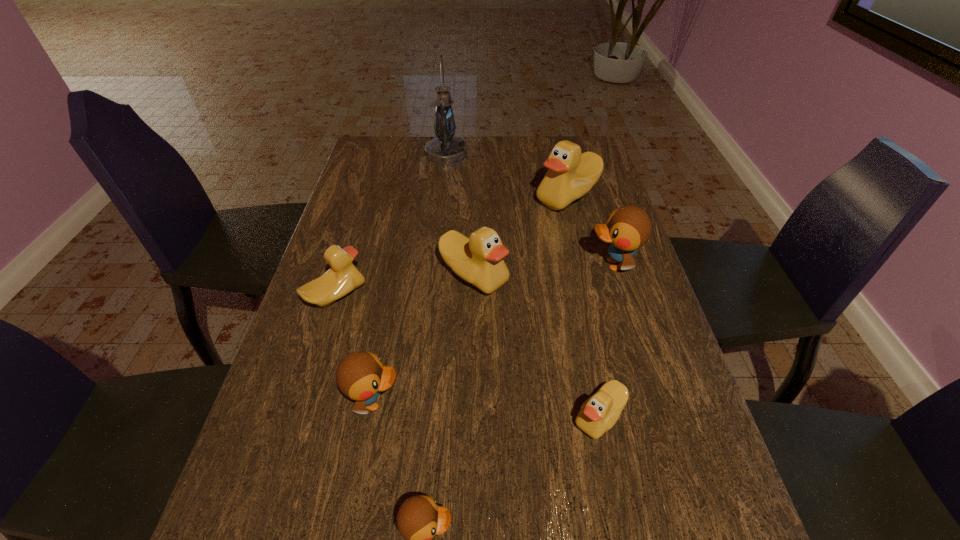
You are a GUI agent. You are given a task and a screenshot of the screen. Output one action in this format:
    pyautogui.click(x=<x>, y=<y>)
    Task: Click on the vacant area between the leftmost beige duck and the second nearest blue duck
    The height and width of the screenshot is (540, 960).
    Given the screenshot: What is the action you would take?
    click(355, 348)

Image resolution: width=960 pixels, height=540 pixels. What are the coordinates of `vacant area between the tallest object and the farthest blue duck` in the screenshot? It's located at (530, 209).

Identify the location of unoccupied position between the farthest blue duck and the biggest beige duck. This screenshot has height=540, width=960. (590, 231).

Where is `vacant region between the second smallest beige duck and the second duck from left to right`? The width and height of the screenshot is (960, 540). vacant region between the second smallest beige duck and the second duck from left to right is located at coordinates (355, 348).

Identify the location of blank region between the third beige duck from right to left and the nearest beige duck. Image resolution: width=960 pixels, height=540 pixels. (537, 346).

In order to click on free space between the farthest beige duck and the tallest object in this screenshot , I will do `click(507, 175)`.

What are the coordinates of `free space between the second nearest blue duck and the tallest object` in the screenshot? It's located at (411, 278).

Where is `object that is the third closest to the second blue duck from right to left`? The image size is (960, 540). object that is the third closest to the second blue duck from right to left is located at coordinates (343, 277).

You are a GUI agent. You are given a task and a screenshot of the screen. Output one action in this format:
    pyautogui.click(x=<x>, y=<y>)
    Task: Click on the object that ranks as the closest to the nearest beige duck
    
    Given the screenshot: What is the action you would take?
    pyautogui.click(x=419, y=518)

Where is `duck that is the closest to the nearest duck`? The image size is (960, 540). duck that is the closest to the nearest duck is located at coordinates (361, 376).